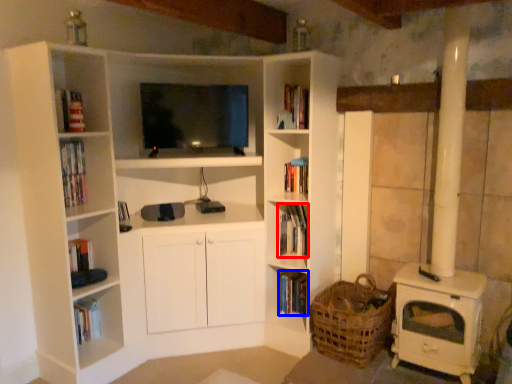
Question: Among these objects, which one is farthest to the camera, book (highlighted by a red box) or book (highlighted by a blue box)?

Choices:
 (A) book
 (B) book

Answer: (B)